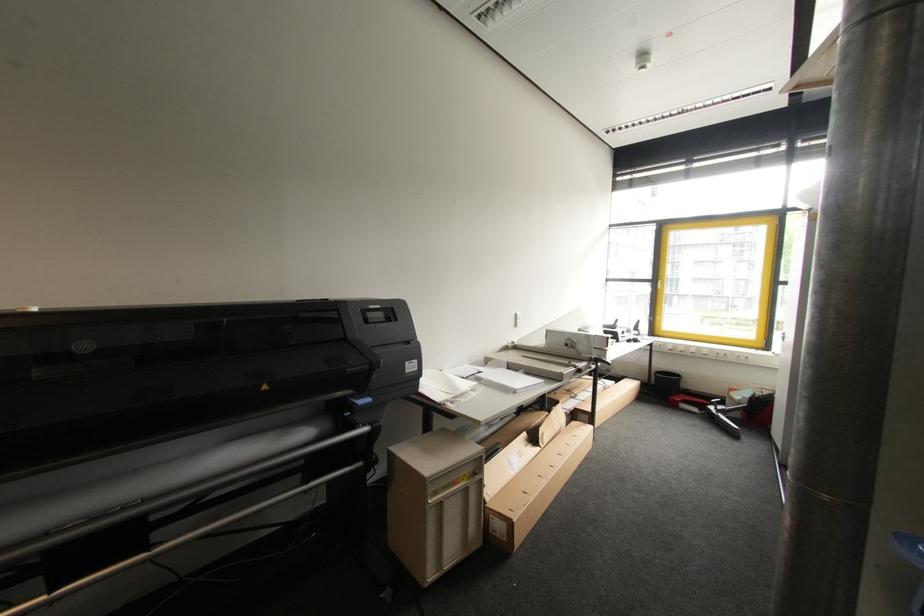
Find where to lift the black trash can. Please return your answer as a coordinate pair (x, y).

(665, 384)